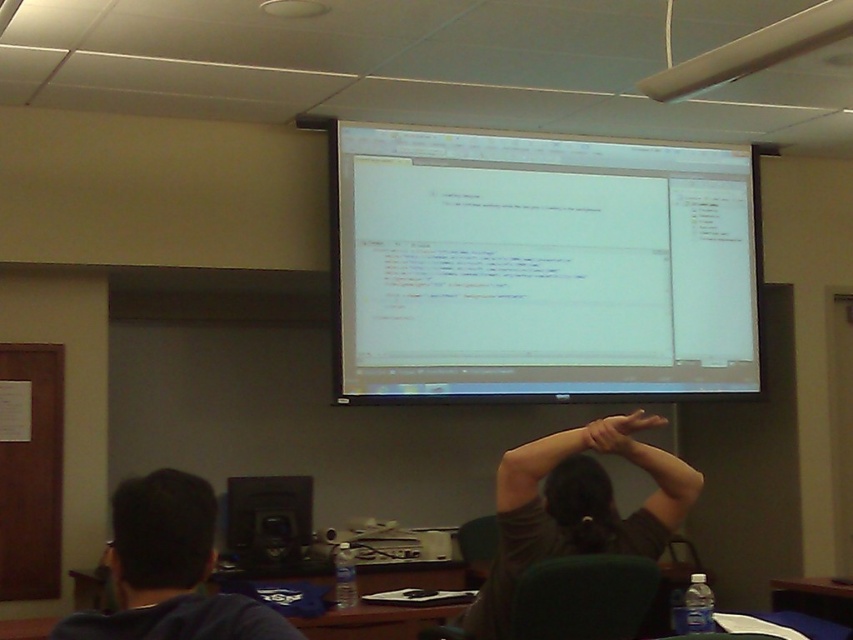
At what (x,y) coordinates should I click in order to perform the action: click on white glossy projection screen at upper center. Please return your answer as a coordinate pair (x, y). This screenshot has height=640, width=853. Looking at the image, I should click on (540, 266).

Can you confirm if white glossy projection screen at upper center is positioned below dark blue hoodie at lower left?

No, white glossy projection screen at upper center is not below dark blue hoodie at lower left.

What do you see at coordinates (540, 266) in the screenshot? The width and height of the screenshot is (853, 640). I see `white glossy projection screen at upper center` at bounding box center [540, 266].

I want to click on white glossy projection screen at upper center, so click(540, 266).

Measure the distance between black plastic speaker at lower center and camera.

black plastic speaker at lower center and camera are 15.95 feet apart.

In the scene shown: Is black plastic speaker at lower center closer to camera compared to matte skin hand at upper center?

Yes, black plastic speaker at lower center is in front of matte skin hand at upper center.

Who is more distant from viewer, (265, 513) or (656, 419)?

The point (265, 513) is behind.

At what (x,y) coordinates should I click in order to perform the action: click on black plastic speaker at lower center. Please return your answer as a coordinate pair (x, y). This screenshot has height=640, width=853. Looking at the image, I should click on (268, 518).

Is point (659, 541) in front of point (198, 557)?

No, it is not.

Does dark brown shirt at upper center appear under dark blue hoodie at lower left?

Correct, dark brown shirt at upper center is located below dark blue hoodie at lower left.

Locate an element on the screen. dark brown shirt at upper center is located at coordinates (576, 508).